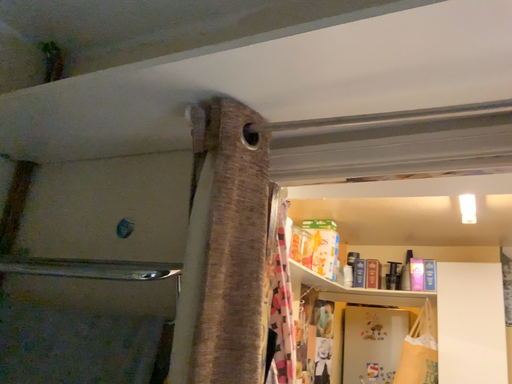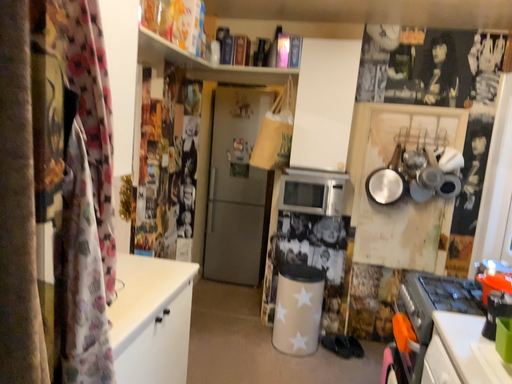
Question: How did the camera likely rotate when shooting the video?

Choices:
 (A) rotated left
 (B) rotated right

Answer: (B)